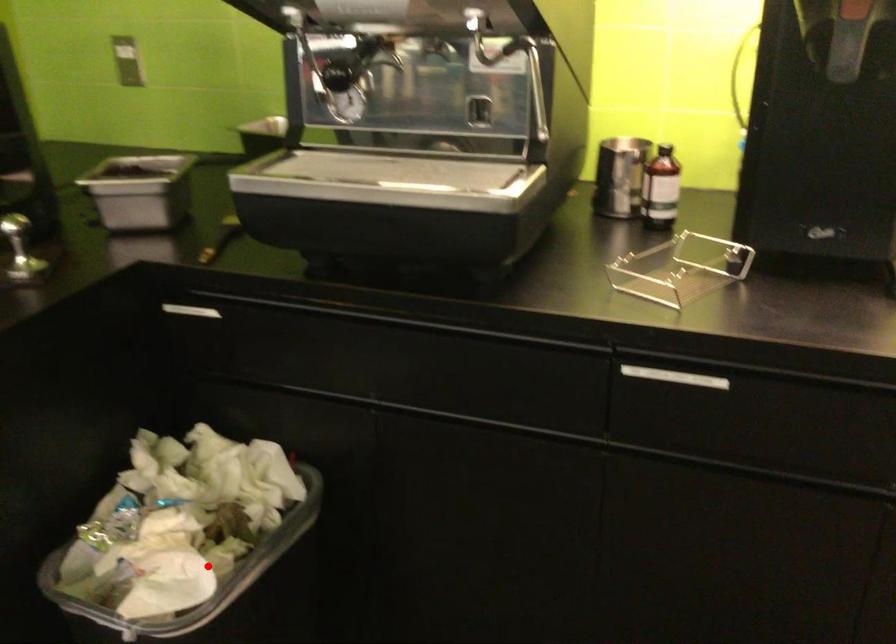
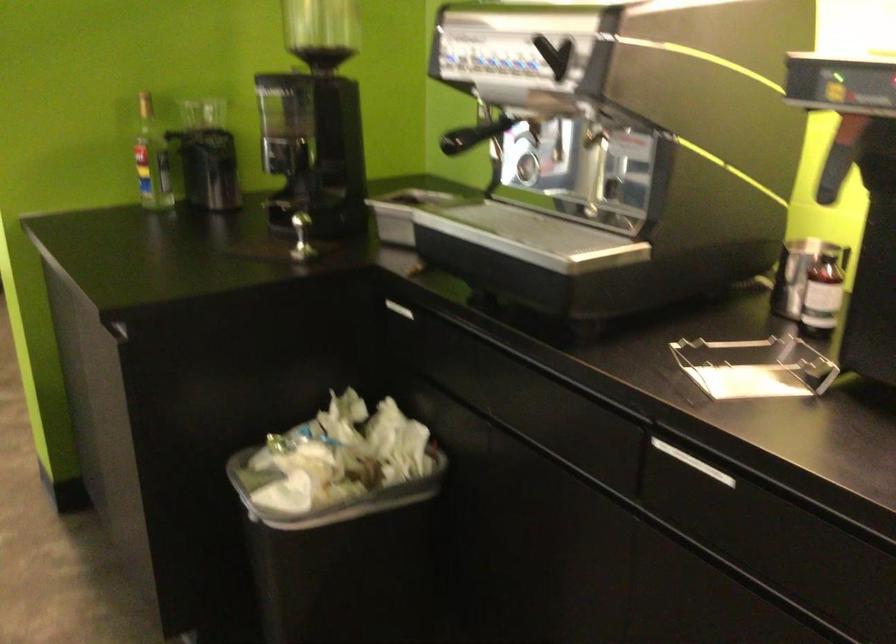
Question: I am providing you with two images of the same scene from different viewpoints. Image1 has a red point marked. In image2, the corresponding 3D location appears at what relative position? Reply with the corresponding letter.

Choices:
 (A) Closer
 (B) Farther

Answer: (B)